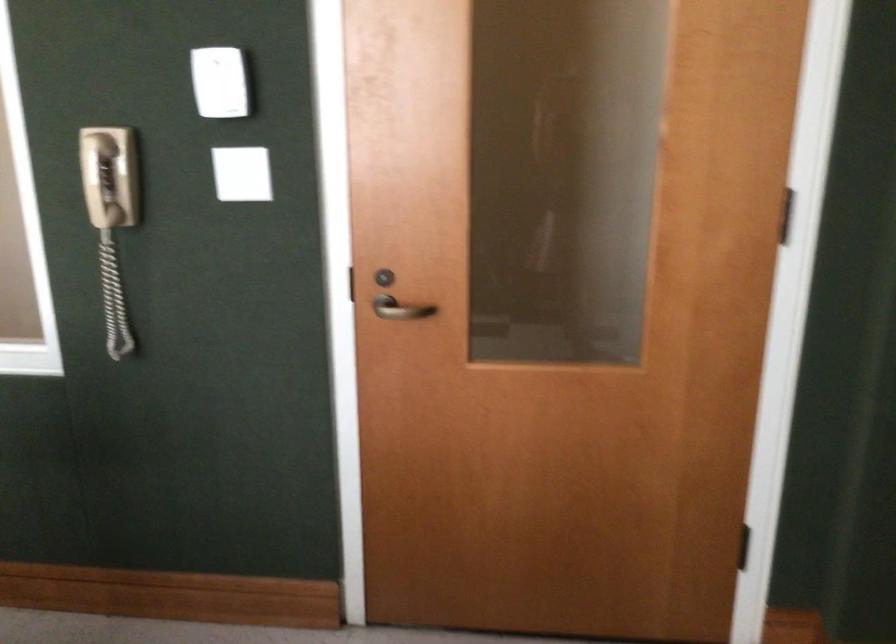
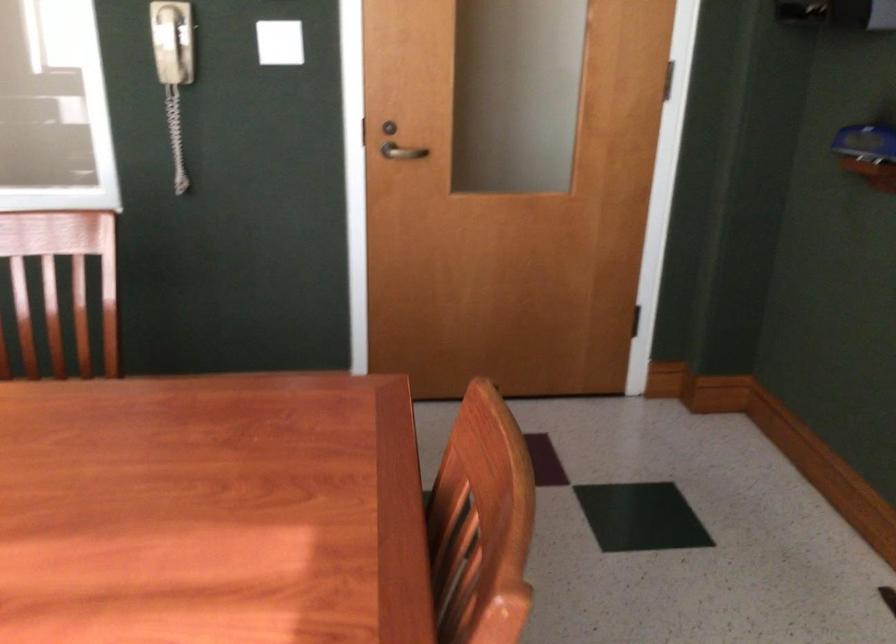
Locate, in the second image, the point that corresponds to point (398, 314) in the first image.

(401, 152)